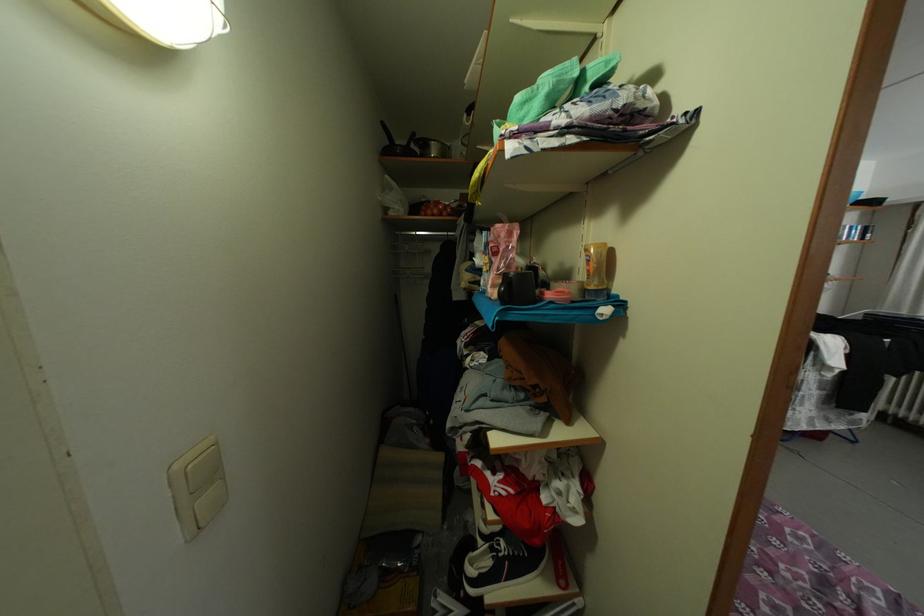
The image size is (924, 616). I want to click on pink food bag, so click(x=499, y=256).